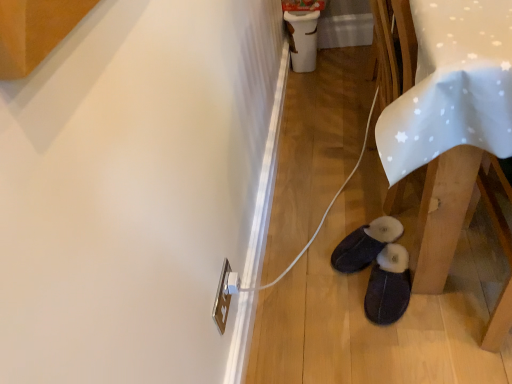
Where is `free space to the left of dark gray suede slippers at lower center, the 1th footwear when ordered from front to back`? free space to the left of dark gray suede slippers at lower center, the 1th footwear when ordered from front to back is located at coordinates (328, 302).